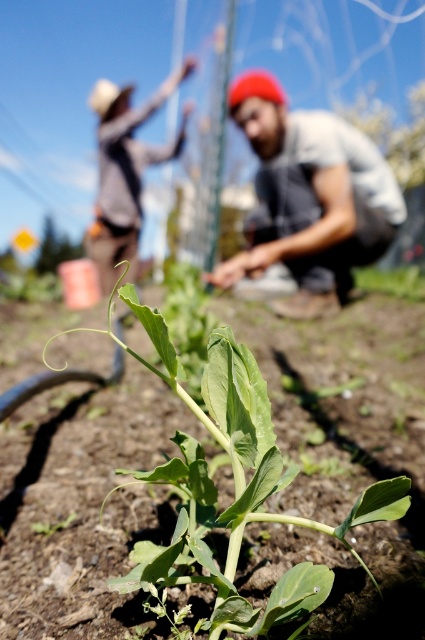
Question: Which of the following is the closest to the observer?

Choices:
 (A) (200, 419)
 (B) (294, 225)

Answer: (A)

Question: Which of the following is the farthest from the observer?

Choices:
 (A) gray fabric shirt at center
 (B) green leafy plant at center

Answer: (A)

Question: Is green leafy plant at center to the right of gray fabric shirt at center from the viewer's perspective?

Choices:
 (A) yes
 (B) no

Answer: (B)

Question: Which of the following is the farthest from the observer?

Choices:
 (A) (294, 616)
 (B) (314, 179)

Answer: (B)

Question: Is green leafy plant at center to the right of gray fabric shirt at center from the viewer's perspective?

Choices:
 (A) yes
 (B) no

Answer: (B)

Question: Observing the image, what is the correct spatial positioning of green leafy plant at center in reference to gray fabric shirt at center?

Choices:
 (A) right
 (B) left

Answer: (B)